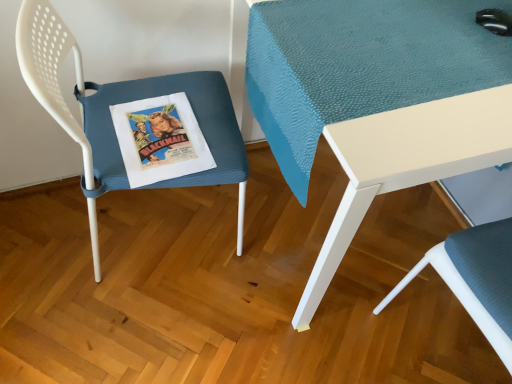
Question: From a real-world perspective, is textured blue cushion at lower right, the first chair positioned from the right, positioned under teal fabric table at center based on gravity?

Choices:
 (A) no
 (B) yes

Answer: (A)

Question: Is textured blue cushion at lower right, placed as the second chair when sorted from left to right, bigger than teal fabric table at center?

Choices:
 (A) no
 (B) yes

Answer: (A)

Question: Is textured blue cushion at lower right, the first chair positioned from the right, not near teal fabric table at center?

Choices:
 (A) no
 (B) yes

Answer: (A)

Question: Is textured blue cushion at lower right, placed as the second chair when sorted from left to right, to the left of teal fabric table at center from the viewer's perspective?

Choices:
 (A) yes
 (B) no

Answer: (B)

Question: Considering the relative sizes of textured blue cushion at lower right, placed as the second chair when sorted from left to right, and teal fabric table at center in the image provided, is textured blue cushion at lower right, placed as the second chair when sorted from left to right, taller than teal fabric table at center?

Choices:
 (A) no
 (B) yes

Answer: (B)

Question: From the image's perspective, would you say textured blue cushion at lower right, placed as the second chair when sorted from left to right, is shown under teal fabric table at center?

Choices:
 (A) yes
 (B) no

Answer: (A)

Question: Can you confirm if blue textured cushion at left, which is the 1th chair from left to right, is bigger than teal fabric table at center?

Choices:
 (A) no
 (B) yes

Answer: (A)

Question: From the image's perspective, is blue textured cushion at left, which is the 1th chair from left to right, located beneath teal fabric table at center?

Choices:
 (A) yes
 (B) no

Answer: (A)

Question: Is blue textured cushion at left, which is the 1th chair from left to right, closer to the viewer compared to teal fabric table at center?

Choices:
 (A) yes
 (B) no

Answer: (A)

Question: Considering the relative sizes of blue textured cushion at left, which appears as the 2th chair when viewed from the right, and teal fabric table at center in the image provided, is blue textured cushion at left, which appears as the 2th chair when viewed from the right, smaller than teal fabric table at center?

Choices:
 (A) no
 (B) yes

Answer: (B)

Question: Is blue textured cushion at left, which is the 1th chair from left to right, outside of teal fabric table at center?

Choices:
 (A) no
 (B) yes

Answer: (B)

Question: Can you confirm if blue textured cushion at left, which appears as the 2th chair when viewed from the right, is positioned to the right of teal fabric table at center?

Choices:
 (A) no
 (B) yes

Answer: (A)

Question: From a real-world perspective, is textured blue cushion at lower right, the first chair positioned from the right, located higher than blue textured cushion at left, which is the 1th chair from left to right?

Choices:
 (A) yes
 (B) no

Answer: (B)